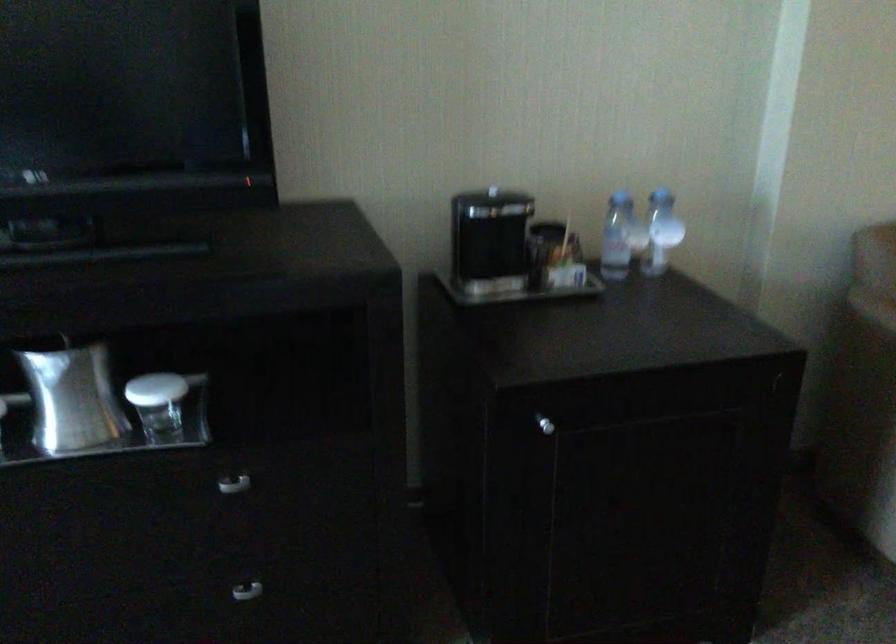
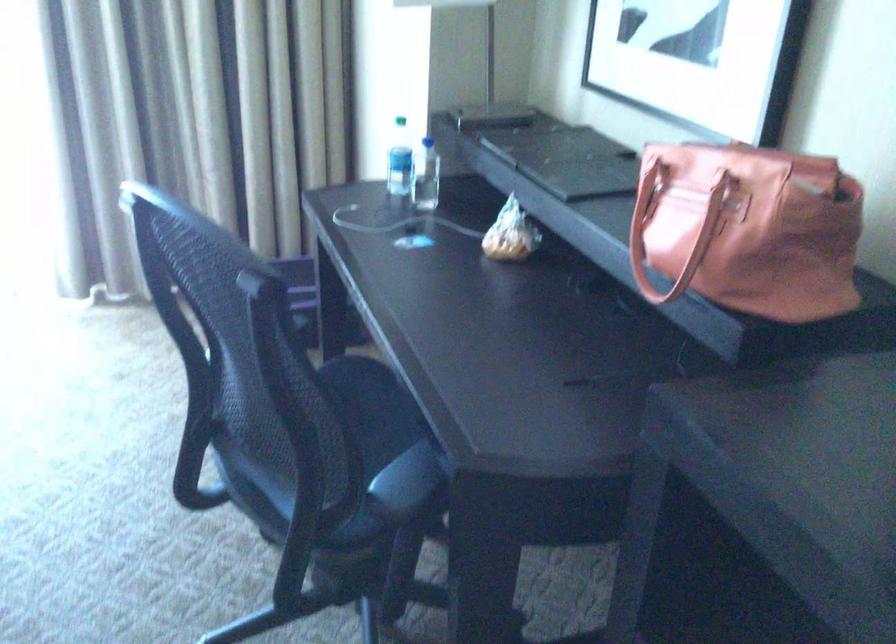
First-person continuous shooting, in which direction is the camera rotating?

The camera's rotation is toward left-down.